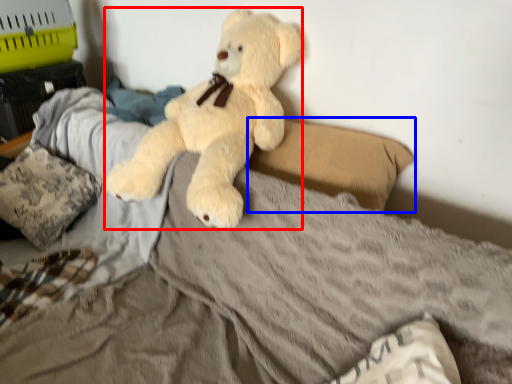
Question: Which of the following is the farthest to the observer, teddy bear (highlighted by a red box) or pillow (highlighted by a blue box)?

Choices:
 (A) teddy bear
 (B) pillow

Answer: (B)